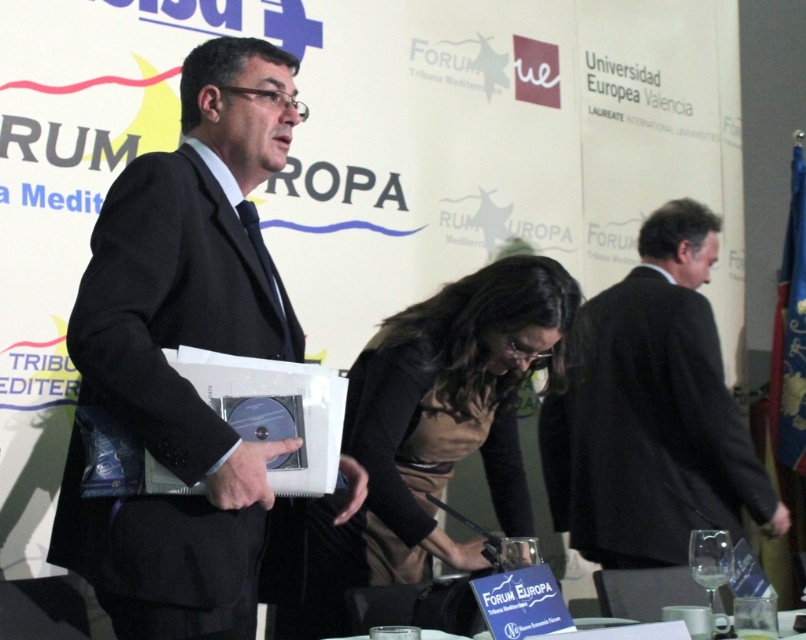
Question: Is black suit at center smaller than brown fabric dress at center?

Choices:
 (A) no
 (B) yes

Answer: (A)

Question: Which object is positioned farthest from the black suit at center?

Choices:
 (A) matte black suit at center
 (B) brown fabric dress at center

Answer: (A)

Question: Which object appears closest to the camera in this image?

Choices:
 (A) brown fabric dress at center
 (B) black suit at center
 (C) matte black suit at center

Answer: (C)

Question: Which object is the farthest from the matte black suit at center?

Choices:
 (A) black suit at center
 (B) brown fabric dress at center

Answer: (A)

Question: Where is matte black suit at center located in relation to brown fabric dress at center in the image?

Choices:
 (A) right
 (B) left

Answer: (B)

Question: Does black suit at center have a greater width compared to brown fabric dress at center?

Choices:
 (A) yes
 (B) no

Answer: (A)